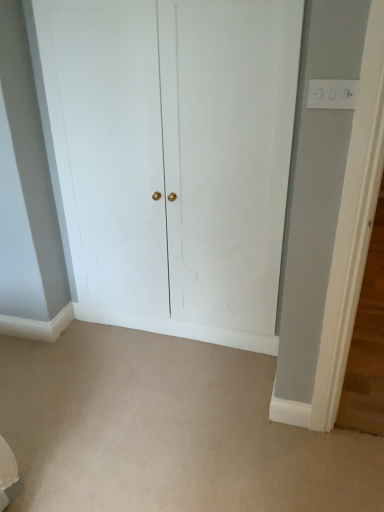
The height and width of the screenshot is (512, 384). Find the location of `blank space situated above beige carpet at center (from a real-world perspective)`. blank space situated above beige carpet at center (from a real-world perspective) is located at coordinates (144, 403).